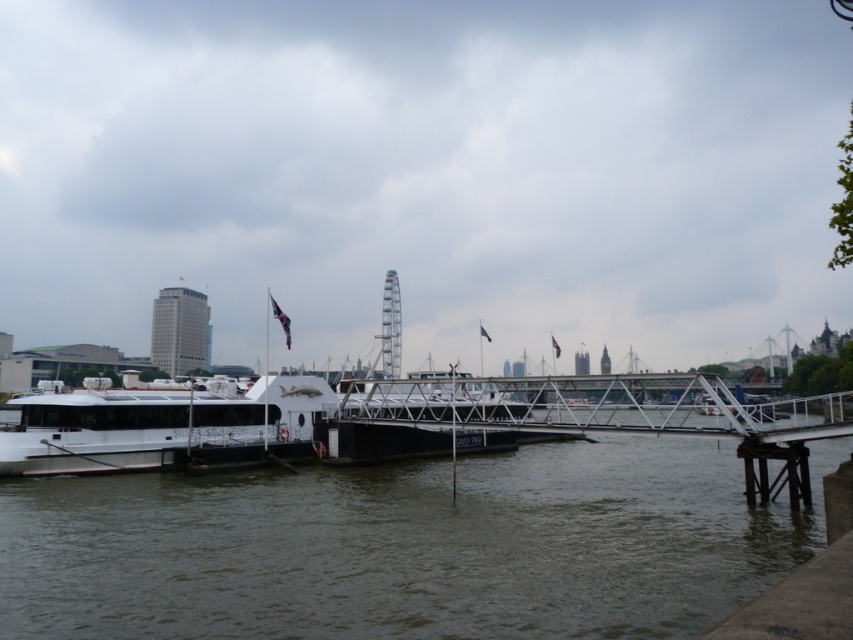
Consider the image. You are standing on the pier next to the white matte boat at left and want to throw a lifebuoy to someone in the brown water at lower left. The lifebuoy can travel 10 meters. Will it reach the person?

The brown water at lower left is 9.97 meters away from the white matte boat at left. Since the lifebuoy can travel 10 meters, it will reach the person in the brown water at lower left.

You are a photographer positioned on the dock and want to capture a clear shot of the white matte boat at left without the brown water at lower left obstructing it. How should you adjust your position?

The brown water at lower left is in front of the white matte boat at left, so you should move your position to the right side of the dock to ensure the boat is visible behind the water or adjust your angle to frame the boat beyond the water.